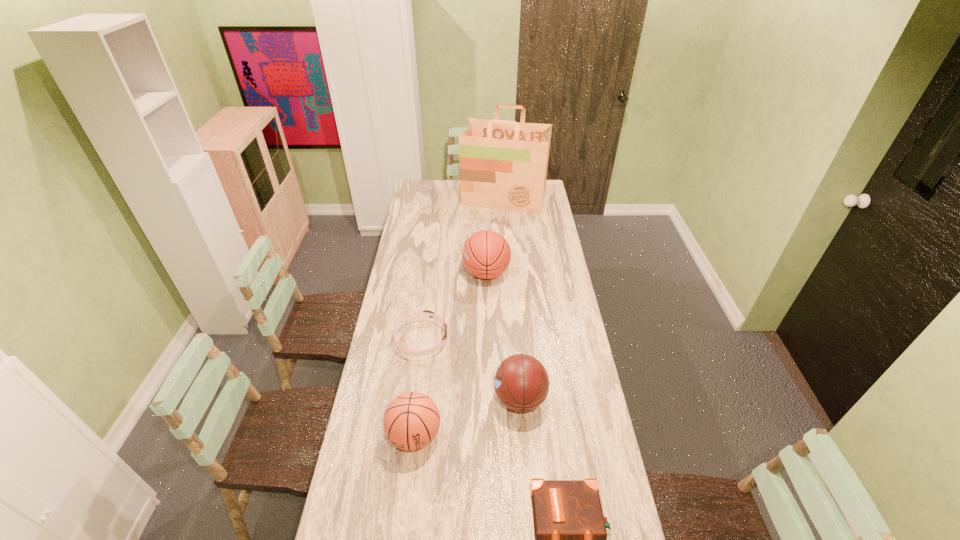
This screenshot has height=540, width=960. What are the coordinates of `grocery bag` in the screenshot? It's located at (503, 164).

Locate an element on the screen. the farthest object is located at coordinates (503, 164).

At what (x,y) coordinates should I click in order to perform the action: click on the farthest basketball. Please return your answer as a coordinate pair (x, y). The height and width of the screenshot is (540, 960). Looking at the image, I should click on (486, 254).

Identify the location of the leftmost basketball. The width and height of the screenshot is (960, 540). (411, 421).

This screenshot has width=960, height=540. In order to click on dog collar in this screenshot , I will do `click(426, 313)`.

The width and height of the screenshot is (960, 540). I want to click on vacant space located on the front of the tallest object, so click(x=506, y=228).

This screenshot has height=540, width=960. What are the coordinates of `free space located 0.280m on the logo side of the farthest basketball` in the screenshot? It's located at (406, 273).

Identify the location of vacant space located 0.130m on the logo side of the farthest basketball. (437, 273).

Locate an element on the screen. The height and width of the screenshot is (540, 960). vacant area located on the logo side of the farthest basketball is located at coordinates (434, 273).

The width and height of the screenshot is (960, 540). I want to click on vacant space located 0.080m on the surface of the leftmost basketball near the brand logo, so click(409, 487).